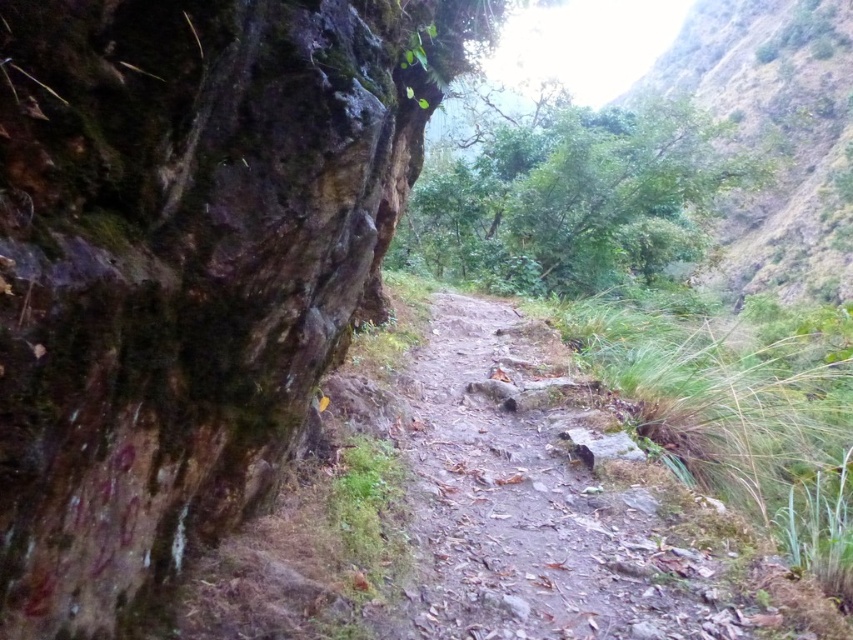
You are a hiker carrying a heavy backpack and need to choose between the dusty gravel path at center and the green leafy hillside at upper right. Based on the scene description, which path is more suitable for walking?

The dusty gravel path at center is positioned on the left side of green leafy hillside at upper right, so the dusty gravel path at center is more suitable for walking as it is described as a path, while the hillside may be uneven and overgrown with vegetation.

You are standing at the starting point of the dirt path and want to reach the end of the path. Which of the two points, point (77, 435) or point (819, 38), is closer to you as you begin your journey?

Point (77, 435) is closer to the viewer than point (819, 38), so the point (77, 435) is closer to you as you begin your journey.

You are hiking along the narrow dirt path and want to take a photo of both the green mossy rock at left and the green leafy hillside at upper right. Which object should you focus on first to ensure both are in the frame?

You should focus on the green mossy rock at left first because it is closer to the viewer than the green leafy hillside at upper right, so adjusting focus starting from the closer object will help capture both in the frame.